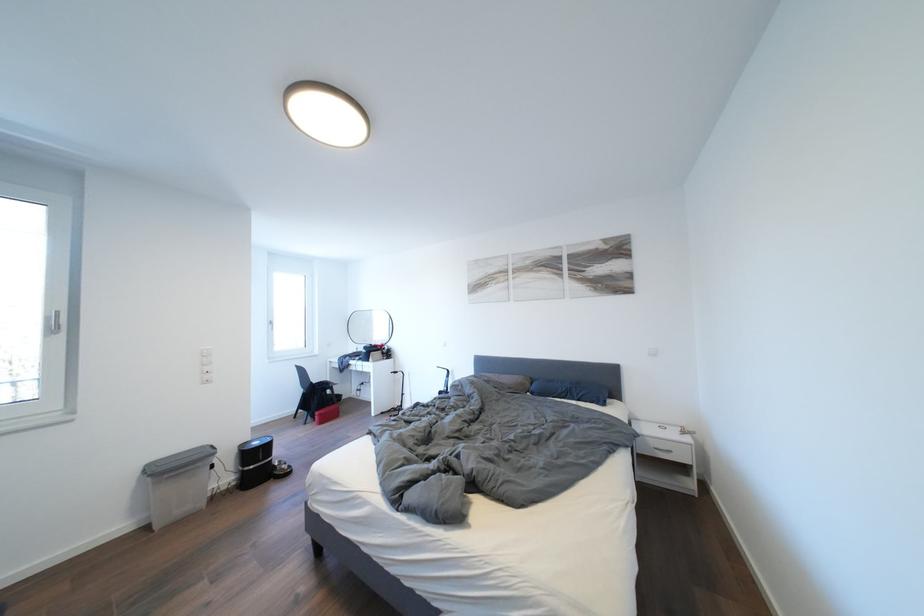
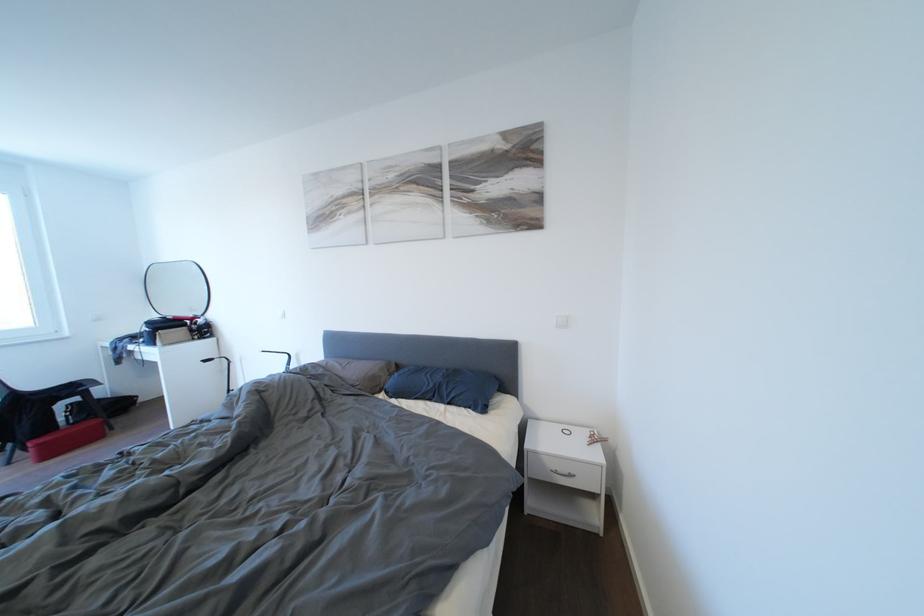
Locate, in the second image, the point that corresponds to pixel 515 384 in the first image.

(363, 375)